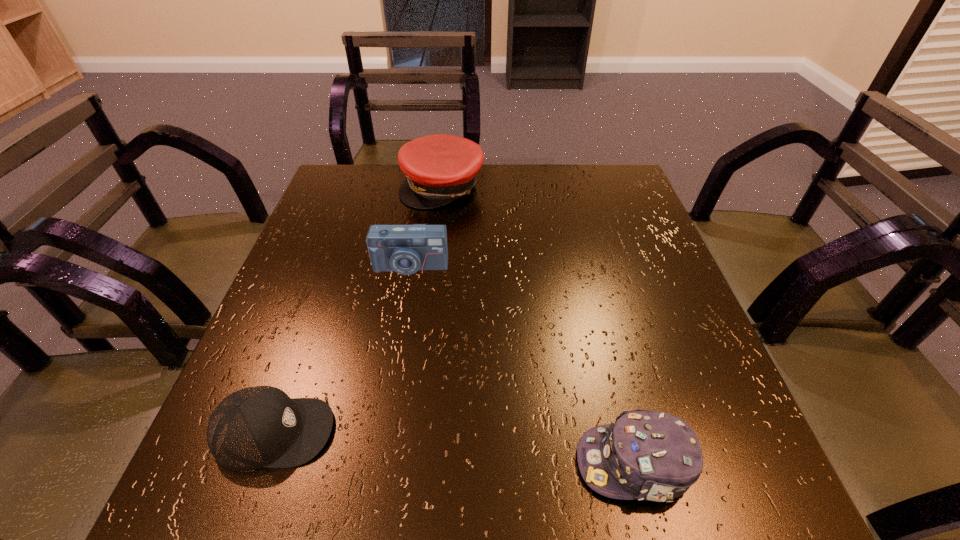
This screenshot has height=540, width=960. I want to click on vacant space in between the rightmost object and the second farthest object, so click(522, 365).

Locate an element on the screen. This screenshot has width=960, height=540. free space between the tallest headwear and the rightmost headwear is located at coordinates tap(539, 325).

At what (x,y) coordinates should I click in order to perform the action: click on object that can be found as the third closest to the leftmost headwear. Please return your answer as a coordinate pair (x, y). The width and height of the screenshot is (960, 540). Looking at the image, I should click on (440, 168).

Locate which object ranks third in proximity to the leftmost headwear. Please provide its 2D coordinates. Your answer should be formatted as a tuple, i.e. [(x, y)], where the tuple contains the x and y coordinates of a point satisfying the conditions above.

[(440, 168)]

Identify the location of the closest headwear relative to the farthest object. The image size is (960, 540). (255, 427).

Find the location of a particular element. headwear that stands as the closest to the leftmost headwear is located at coordinates (646, 455).

The image size is (960, 540). Identify the location of free space that satisfies the following two spatial constraints: 1. on the lens of the third nearest object; 2. on the front-facing side of the leftmost headwear. (381, 433).

The image size is (960, 540). Identify the location of free point that satisfies the following two spatial constraints: 1. on the front-facing side of the second headwear from right to left; 2. on the front-facing side of the leftmost headwear. (415, 433).

Where is `vacant space that satisfies the following two spatial constraints: 1. on the front-facing side of the farthest object; 2. on the front-facing side of the leftmost headwear`? This screenshot has height=540, width=960. vacant space that satisfies the following two spatial constraints: 1. on the front-facing side of the farthest object; 2. on the front-facing side of the leftmost headwear is located at coordinates (415, 433).

This screenshot has width=960, height=540. Find the location of `free space that satisfies the following two spatial constraints: 1. on the front-facing side of the tallest headwear; 2. on the front-facing side of the leftmost headwear`. free space that satisfies the following two spatial constraints: 1. on the front-facing side of the tallest headwear; 2. on the front-facing side of the leftmost headwear is located at coordinates (415, 433).